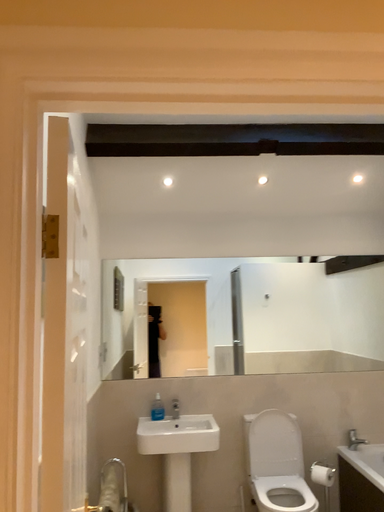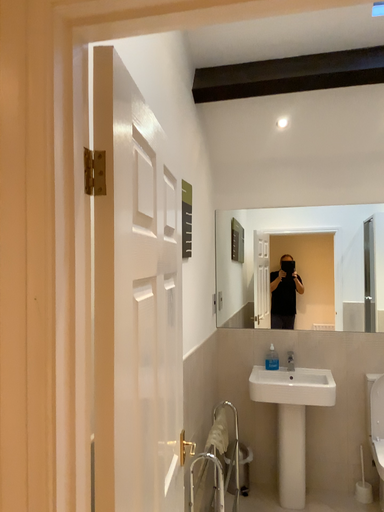
Question: Which way did the camera rotate in the video?

Choices:
 (A) rotated upward
 (B) rotated downward

Answer: (B)